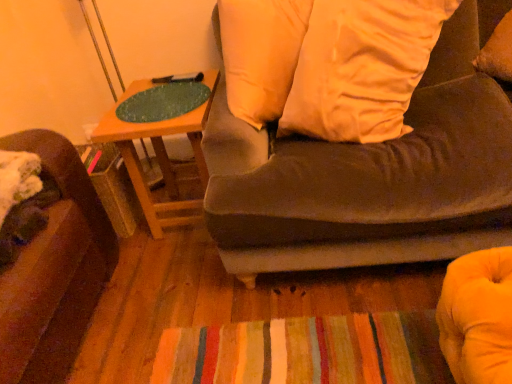
Question: Visually, is white soft pillow at upper center positioned to the left or to the right of wooden table at upper center?

Choices:
 (A) right
 (B) left

Answer: (A)

Question: Is point (359, 19) closer or farther from the camera than point (192, 220)?

Choices:
 (A) farther
 (B) closer

Answer: (B)

Question: Considering the real-world distances, which object is closest to the suede-like brown couch at upper right?

Choices:
 (A) green felt at upper left
 (B) wooden table at upper center
 (C) white soft pillow at upper center

Answer: (C)

Question: Considering the real-world distances, which object is closest to the wooden table at upper center?

Choices:
 (A) suede-like brown couch at upper right
 (B) white soft pillow at upper center
 (C) green felt at upper left

Answer: (C)